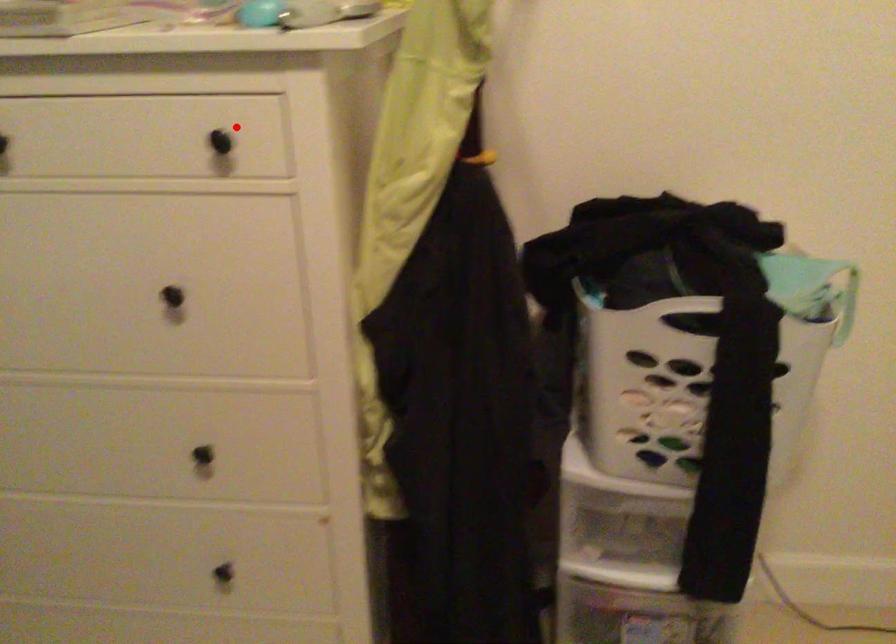
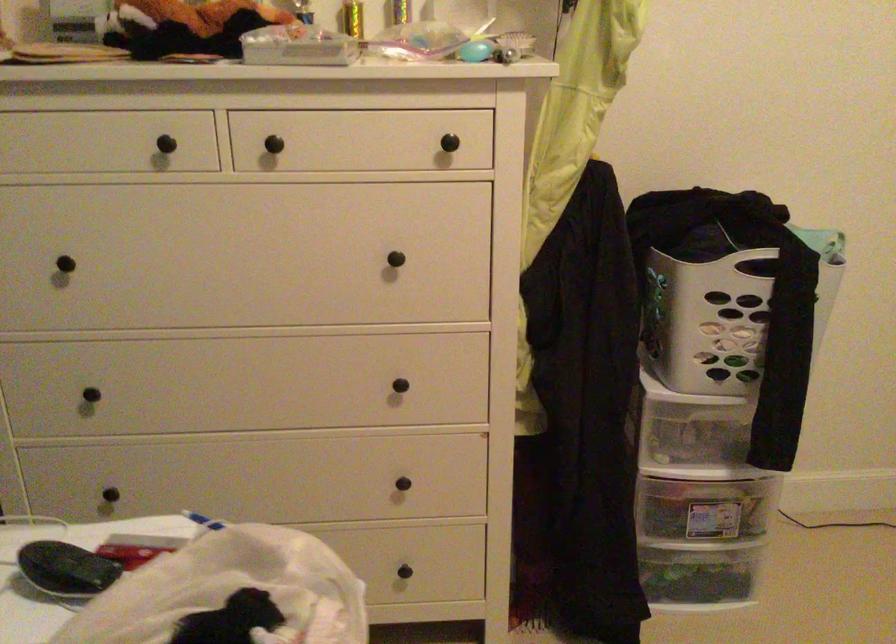
Question: I am providing you with two images of the same scene from different viewpoints. Image1 has a red point marked. In image2, the corresponding 3D location appears at what relative position? Reply with the corresponding letter.

Choices:
 (A) Closer
 (B) Farther

Answer: (B)